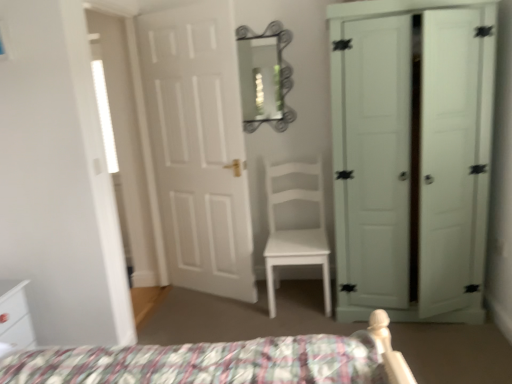
The image size is (512, 384). What do you see at coordinates (199, 146) in the screenshot? I see `white matte door at center, marked as the 2th door in a right-to-left arrangement` at bounding box center [199, 146].

What do you see at coordinates (14, 317) in the screenshot? I see `white glossy nightstand at lower left` at bounding box center [14, 317].

This screenshot has width=512, height=384. Describe the element at coordinates (280, 74) in the screenshot. I see `metallic silver mirror at upper center` at that location.

This screenshot has width=512, height=384. In order to click on white matte door at center, which is counted as the first door, starting from the left in this screenshot , I will do `click(199, 146)`.

Is white matte door at center, which is counted as the first door, starting from the left, completely or partially outside of metallic silver mirror at upper center?

That's correct, white matte door at center, which is counted as the first door, starting from the left, is outside of metallic silver mirror at upper center.

From a real-world perspective, is white matte door at center, which is counted as the first door, starting from the left, physically located above or below metallic silver mirror at upper center?

white matte door at center, which is counted as the first door, starting from the left, is below metallic silver mirror at upper center.

Identify the location of door that is the 1st object located below the metallic silver mirror at upper center (from the image's perspective). (199, 146).

Is white matte door at center, marked as the 2th door in a right-to-left arrangement, far away from metallic silver mirror at upper center?

No, white matte door at center, marked as the 2th door in a right-to-left arrangement, is not far away from metallic silver mirror at upper center.

Looking at this image, is metallic silver mirror at upper center shorter than white matte chair at center?

Yes.

Is there a large distance between metallic silver mirror at upper center and white matte chair at center?

metallic silver mirror at upper center is actually quite close to white matte chair at center.

Is metallic silver mirror at upper center positioned before white matte chair at center?

No, it is behind white matte chair at center.

Can you confirm if metallic silver mirror at upper center is thinner than white matte chair at center?

Yes.

How distant is white matte door at right, which is the second door from left to right, from metallic silver mirror at upper center?

1.00 meters.

Is white matte door at right, which is the second door from left to right, positioned before metallic silver mirror at upper center?

Yes, the depth of white matte door at right, which is the second door from left to right, is less than that of metallic silver mirror at upper center.

Is white matte door at right, which is the second door from left to right, spatially inside metallic silver mirror at upper center, or outside of it?

white matte door at right, which is the second door from left to right, exists outside the volume of metallic silver mirror at upper center.

Who is smaller, white matte door at right, marked as the first door in a right-to-left arrangement, or metallic silver mirror at upper center?

metallic silver mirror at upper center is smaller.

From a real-world perspective, between white matte chair at center and metallic silver mirror at upper center, who is vertically lower?

From a 3D spatial view, white matte chair at center is below.

Who is bigger, white matte chair at center or metallic silver mirror at upper center?

white matte chair at center is bigger.

Based on the photo, considering the relative sizes of white matte chair at center and metallic silver mirror at upper center in the image provided, is white matte chair at center wider than metallic silver mirror at upper center?

Yes.

The image size is (512, 384). I want to click on mirror that is on the left side of white matte chair at center, so click(280, 74).

From the image's perspective, which one is positioned lower, white matte door at center, which is counted as the first door, starting from the left, or white matte chair at center?

white matte chair at center, from the image's perspective.

Which is behind, point (164, 145) or point (311, 165)?

The point (311, 165) is farther.

Is white matte door at center, which is counted as the first door, starting from the left, far from white matte chair at center?

That's not correct — white matte door at center, which is counted as the first door, starting from the left, is a little close to white matte chair at center.

How far apart are white matte door at center, marked as the 2th door in a right-to-left arrangement, and white matte chair at center?

They are 22.42 inches apart.

Consider the image. Between white glossy nightstand at lower left and white matte door at right, marked as the first door in a right-to-left arrangement, which one has larger size?

Bigger between the two is white matte door at right, marked as the first door in a right-to-left arrangement.

At what (x,y) coordinates should I click in order to perform the action: click on nightstand below the white matte door at right, which is the second door from left to right (from a real-world perspective). Please return your answer as a coordinate pair (x, y). Looking at the image, I should click on click(14, 317).

Is white glossy nightstand at lower left far from white matte door at right, marked as the first door in a right-to-left arrangement?

white glossy nightstand at lower left is far away from white matte door at right, marked as the first door in a right-to-left arrangement.

Is white glossy nightstand at lower left inside the boundaries of white matte door at right, which is the second door from left to right, or outside?

The correct answer is: outside.

Does white glossy nightstand at lower left turn towards white matte door at center, which is counted as the first door, starting from the left?

No, white glossy nightstand at lower left is not turned towards white matte door at center, which is counted as the first door, starting from the left.

Is white glossy nightstand at lower left far from white matte door at center, marked as the 2th door in a right-to-left arrangement?

Indeed, white glossy nightstand at lower left is not near white matte door at center, marked as the 2th door in a right-to-left arrangement.

Who is taller, white glossy nightstand at lower left or white matte door at center, which is counted as the first door, starting from the left?

Standing taller between the two is white matte door at center, which is counted as the first door, starting from the left.

You are a GUI agent. You are given a task and a screenshot of the screen. Output one action in this format:
    pyautogui.click(x=<x>, y=<y>)
    Task: Click on the mirror lying behind the white matte door at center, marked as the 2th door in a right-to-left arrangement
    Image resolution: width=512 pixels, height=384 pixels.
    Given the screenshot: What is the action you would take?
    pyautogui.click(x=280, y=74)

Identify the location of chair in front of the metallic silver mirror at upper center. (295, 231).

Which object lies further to the anchor point white matte door at center, marked as the 2th door in a right-to-left arrangement, metallic silver mirror at upper center or white matte door at right, marked as the first door in a right-to-left arrangement?

white matte door at right, marked as the first door in a right-to-left arrangement, is positioned further to the anchor white matte door at center, marked as the 2th door in a right-to-left arrangement.

Based on their spatial positions, is metallic silver mirror at upper center or white matte door at center, marked as the 2th door in a right-to-left arrangement, further from white matte chair at center?

metallic silver mirror at upper center is further to white matte chair at center.

From the image, which object appears to be farther from metallic silver mirror at upper center, white matte door at right, marked as the first door in a right-to-left arrangement, or white matte door at center, which is counted as the first door, starting from the left?

white matte door at right, marked as the first door in a right-to-left arrangement, is further to metallic silver mirror at upper center.

Considering their positions, is white glossy nightstand at lower left positioned further to white matte door at center, marked as the 2th door in a right-to-left arrangement, than metallic silver mirror at upper center?

Among the two, white glossy nightstand at lower left is located further to white matte door at center, marked as the 2th door in a right-to-left arrangement.

Which object lies nearer to the anchor point white matte door at center, which is counted as the first door, starting from the left, white matte door at right, marked as the first door in a right-to-left arrangement, or white matte chair at center?

The object closer to white matte door at center, which is counted as the first door, starting from the left, is white matte chair at center.

From the image, which object appears to be nearer to white matte door at right, which is the second door from left to right, white matte chair at center or white glossy nightstand at lower left?

white matte chair at center lies closer to white matte door at right, which is the second door from left to right, than the other object.

Considering their positions, is white matte chair at center positioned further to white matte door at right, marked as the first door in a right-to-left arrangement, than white matte door at center, marked as the 2th door in a right-to-left arrangement?

Among the two, white matte door at center, marked as the 2th door in a right-to-left arrangement, is located further to white matte door at right, marked as the first door in a right-to-left arrangement.

Looking at the image, which one is located further to white glossy nightstand at lower left, metallic silver mirror at upper center or white matte chair at center?

Among the two, metallic silver mirror at upper center is located further to white glossy nightstand at lower left.

The width and height of the screenshot is (512, 384). Find the location of `mirror between white glossy nightstand at lower left and white matte door at right, marked as the first door in a right-to-left arrangement, from left to right`. mirror between white glossy nightstand at lower left and white matte door at right, marked as the first door in a right-to-left arrangement, from left to right is located at coordinates (280, 74).

You are a GUI agent. You are given a task and a screenshot of the screen. Output one action in this format:
    pyautogui.click(x=<x>, y=<y>)
    Task: Click on the mirror between white matte door at center, which is counted as the first door, starting from the left, and white matte door at right, which is the second door from left to right, from left to right
    The image size is (512, 384).
    Given the screenshot: What is the action you would take?
    pyautogui.click(x=280, y=74)

Identify the location of door located between white glossy nightstand at lower left and white matte chair at center in the left-right direction. The image size is (512, 384). (199, 146).

The image size is (512, 384). I want to click on mirror located between white glossy nightstand at lower left and white matte chair at center in the left-right direction, so click(280, 74).